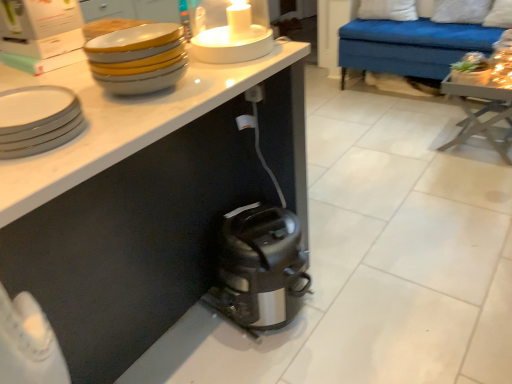
Locate an element on the screen. The width and height of the screenshot is (512, 384). free space between wooden table at right and satin silver toaster at lower center is located at coordinates (381, 221).